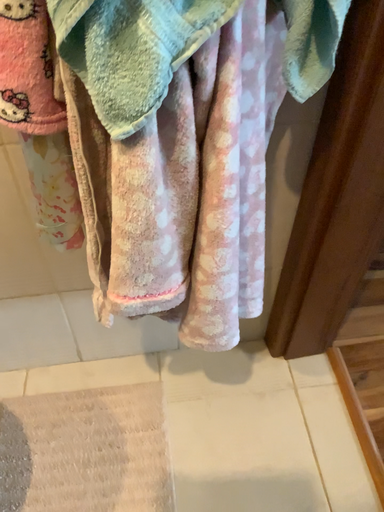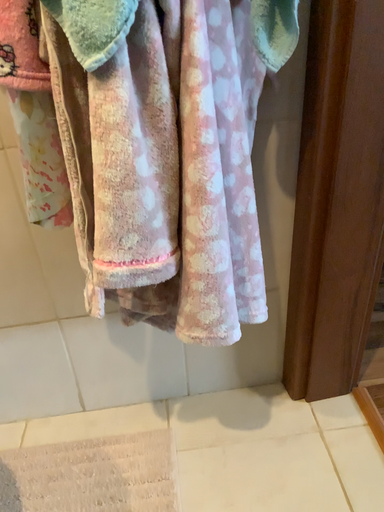
Question: Which way did the camera rotate in the video?

Choices:
 (A) rotated downward
 (B) rotated upward

Answer: (B)